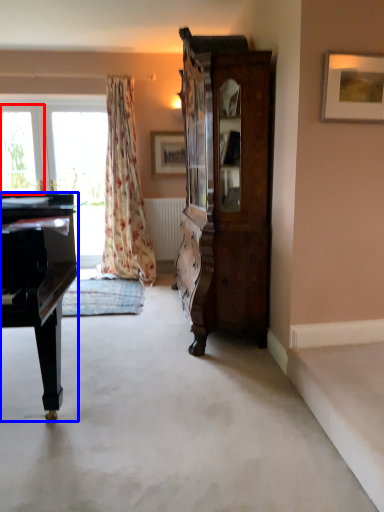
Question: Among these objects, which one is farthest to the camera, window (highlighted by a red box) or piano (highlighted by a blue box)?

Choices:
 (A) window
 (B) piano

Answer: (A)